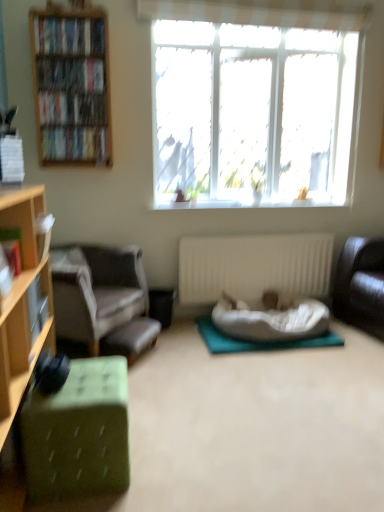
I want to click on vacant space in between green fabric footrest at lower left and teal fabric yoga mat at center, so click(x=194, y=346).